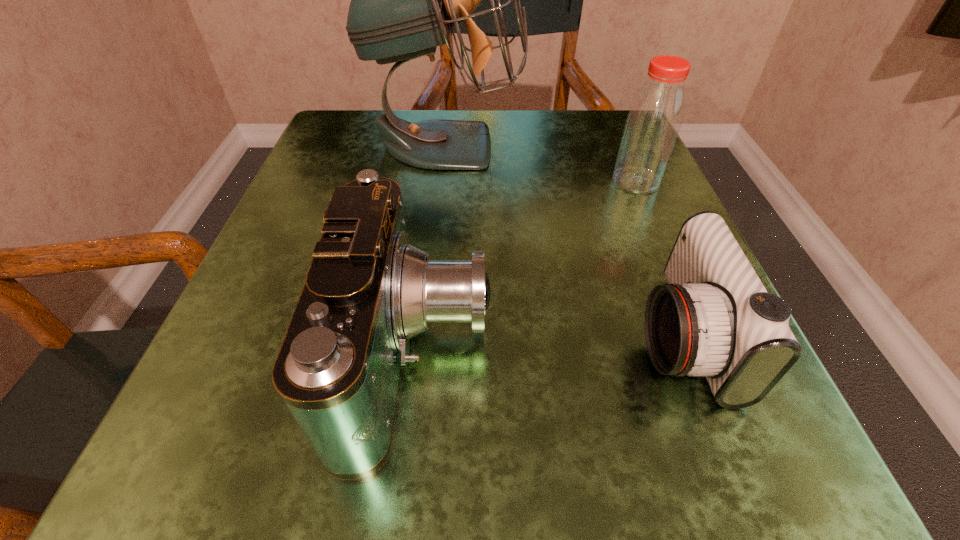
Image resolution: width=960 pixels, height=540 pixels. Find the location of `vacant space that satisfies the following two spatial constraints: 1. on the front-facing side of the fan for air flow; 2. on the left side of the bottle`. vacant space that satisfies the following two spatial constraints: 1. on the front-facing side of the fan for air flow; 2. on the left side of the bottle is located at coordinates (442, 181).

The width and height of the screenshot is (960, 540). I want to click on free location that satisfies the following two spatial constraints: 1. on the front side of the bottle; 2. on the front-facing side of the taller camcorder, so click(711, 353).

I want to click on vacant region that satisfies the following two spatial constraints: 1. on the front side of the bottle; 2. on the surface of the right camcorder, so click(704, 336).

At what (x,y) coordinates should I click in order to perform the action: click on vacant area that satisfies the following two spatial constraints: 1. on the front-facing side of the tallest object for air flow; 2. on the left side of the bottle. Please return your answer as a coordinate pair (x, y). Image resolution: width=960 pixels, height=540 pixels. Looking at the image, I should click on (442, 181).

Where is `blank space that satisfies the following two spatial constraints: 1. on the front-facing side of the bottle for air flow; 2. on the right side of the fan`? blank space that satisfies the following two spatial constraints: 1. on the front-facing side of the bottle for air flow; 2. on the right side of the fan is located at coordinates (442, 181).